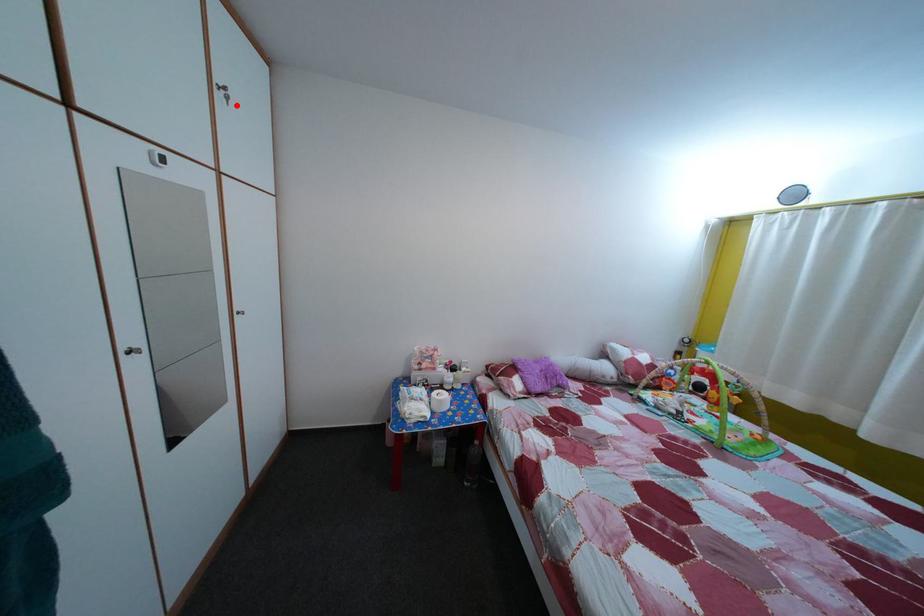
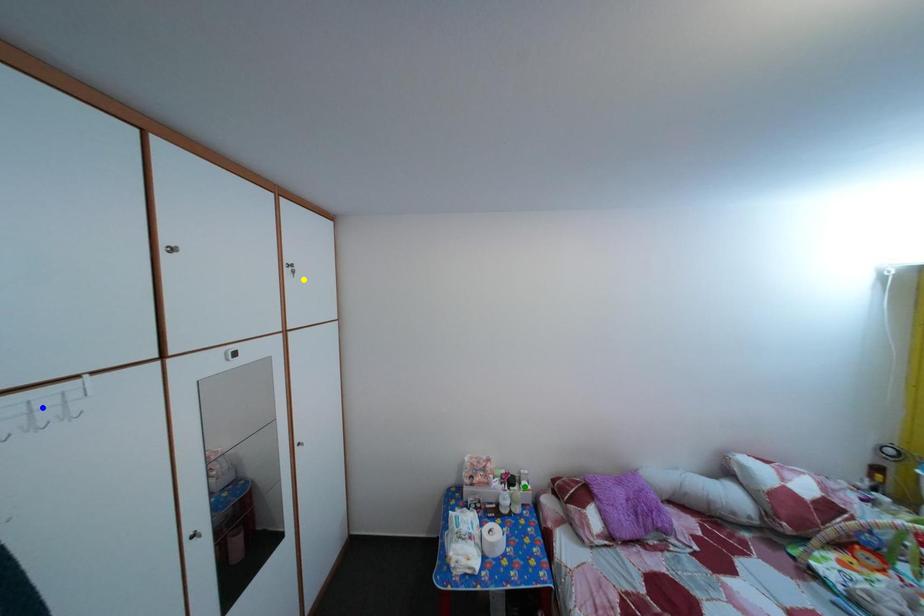
Question: I am providing you with two images of the same scene from different viewpoints. A red point is marked on the first image. You are given multiple points on the second image. Which point in image 2 is actually the same real-world point as the red point in image 1?

Choices:
 (A) yellow point
 (B) green point
 (C) blue point

Answer: (A)